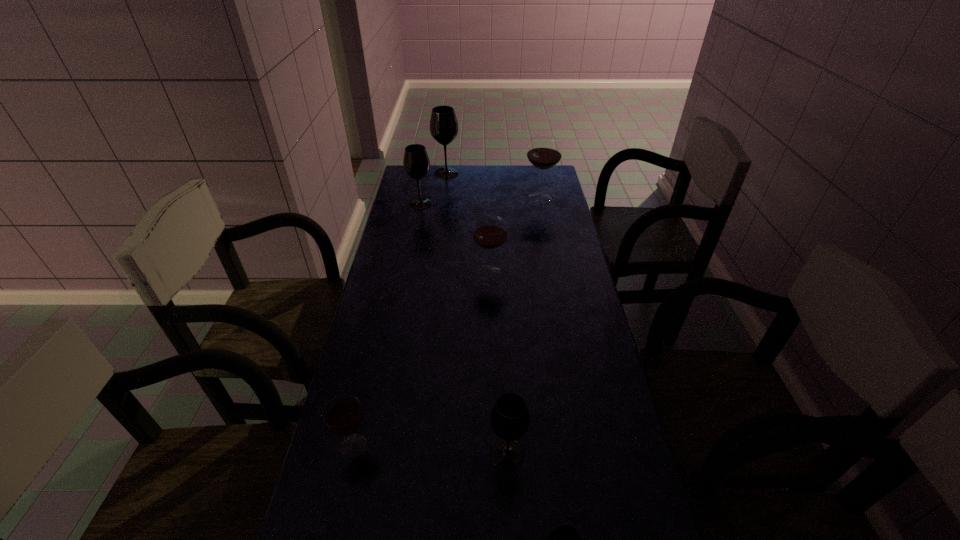
Identify the location of the farthest wineglass. (443, 124).

Find the location of a particular element. The width and height of the screenshot is (960, 540). the biggest gray wineglass is located at coordinates (443, 124).

Where is `the third smallest gray wineglass`? the third smallest gray wineglass is located at coordinates (416, 162).

You are a GUI agent. You are given a task and a screenshot of the screen. Output one action in this format:
    pyautogui.click(x=<x>, y=<y>)
    Task: Click on the rightmost object
    The width and height of the screenshot is (960, 540).
    Given the screenshot: What is the action you would take?
    pyautogui.click(x=544, y=152)

At what (x,y) coordinates should I click in order to perform the action: click on the farthest red wineglass. Please return your answer as a coordinate pair (x, y). Looking at the image, I should click on (544, 152).

Identify the location of the fourth nearest wineglass. (490, 232).

Find the location of a particular element. This screenshot has width=960, height=540. the second smallest red wineglass is located at coordinates (490, 232).

The height and width of the screenshot is (540, 960). I want to click on the third gray wineglass from left to right, so click(x=510, y=419).

This screenshot has width=960, height=540. Identify the location of the second smallest gray wineglass. (510, 419).

Where is `the leftmost red wineglass`? The width and height of the screenshot is (960, 540). the leftmost red wineglass is located at coordinates (343, 414).